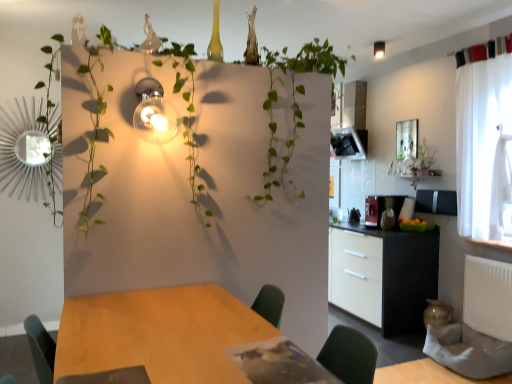
In order to face wooden table at center, should I rotate leftwards or rightwards?

You should rotate left by 11.107 degrees.

Image resolution: width=512 pixels, height=384 pixels. Find the location of `white matte radiator at lower right`. white matte radiator at lower right is located at coordinates tap(488, 297).

This screenshot has width=512, height=384. Describe the element at coordinates (379, 49) in the screenshot. I see `matte glass light fixture at upper right, the first light fixture positioned from the right` at that location.

Locate an element on the screen. The width and height of the screenshot is (512, 384). white sheer curtain at right is located at coordinates (484, 140).

Is the position of black matte cabinet at right less distant than that of green leafy plant at center?

No.

From a real-world perspective, which object stands above the other?

green leafy plant at center is physically above.

Considering the positions of point (389, 325) and point (268, 53), is point (389, 325) closer or farther from the camera than point (268, 53)?

Point (389, 325) appears to be farther away from the viewer than point (268, 53).

Is matte black coffee machine at center right oriented towards white sheer curtain at right?

No.

From the image's perspective, is matte black coffee machine at center right located above or below white sheer curtain at right?

matte black coffee machine at center right is below white sheer curtain at right.

From a real-world perspective, is matte black coffee machine at center right positioned over white sheer curtain at right based on gravity?

No, from a real-world perspective, matte black coffee machine at center right is not over white sheer curtain at right

In the image, is matte black coffee machine at center right on the left side or the right side of white sheer curtain at right?

matte black coffee machine at center right is positioned on white sheer curtain at right's left side.

Which of these two, matte black coffee machine at center right or black matte cabinet at right, is wider?

Wider between the two is black matte cabinet at right.

Between matte black coffee machine at center right and black matte cabinet at right, which one appears on the right side from the viewer's perspective?

From the viewer's perspective, matte black coffee machine at center right appears more on the right side.

Considering the relative sizes of matte black coffee machine at center right and black matte cabinet at right in the image provided, is matte black coffee machine at center right taller than black matte cabinet at right?

No, matte black coffee machine at center right is not taller than black matte cabinet at right.

Is matte black coffee machine at center right surrounded by matte glass light fixture at upper right, which is the 1th light fixture in back-to-front order?

Actually, matte black coffee machine at center right is outside matte glass light fixture at upper right, which is the 1th light fixture in back-to-front order.

Which of these two, matte glass light fixture at upper right, the first light fixture positioned from the right, or matte black coffee machine at center right, is bigger?

matte black coffee machine at center right.

Does matte glass light fixture at upper right, the second light fixture positioned from the bottom, touch matte black coffee machine at center right?

No, matte glass light fixture at upper right, the second light fixture positioned from the bottom, is not touching matte black coffee machine at center right.

From a real-world perspective, is matte glass light fixture at upper right, the second light fixture positioned from the bottom, positioned under matte black coffee machine at center right based on gravity?

No.

Is wooden table at center facing away from matte glass light fixture at upper right, the second light fixture positioned from the bottom?

That's not correct — wooden table at center is not looking away from matte glass light fixture at upper right, the second light fixture positioned from the bottom.

From the image's perspective, is wooden table at center below matte glass light fixture at upper right, the first light fixture positioned from the right?

Correct, wooden table at center appears lower than matte glass light fixture at upper right, the first light fixture positioned from the right, in the image.

Between wooden table at center and matte glass light fixture at upper right, which is the second light fixture from left to right, which one has larger width?

wooden table at center is wider.

Is wooden table at center in front of or behind matte glass light fixture at upper right, the first light fixture positioned from the right, in the image?

Visually, wooden table at center is located in front of matte glass light fixture at upper right, the first light fixture positioned from the right.

Considering the positions of objects white matte radiator at lower right and matte glass light fixture at upper right, arranged as the first light fixture when viewed from the top, in the image provided, who is more to the right, white matte radiator at lower right or matte glass light fixture at upper right, arranged as the first light fixture when viewed from the top,?

white matte radiator at lower right is more to the right.

How many degrees apart are the facing directions of white matte radiator at lower right and matte glass light fixture at upper right, arranged as the first light fixture when viewed from the top?

The angular difference between white matte radiator at lower right and matte glass light fixture at upper right, arranged as the first light fixture when viewed from the top, is 1.52 degrees.

Is white matte radiator at lower right with matte glass light fixture at upper right, which is the second light fixture from left to right?

No, white matte radiator at lower right is not beside matte glass light fixture at upper right, which is the second light fixture from left to right.

Can you confirm if white matte radiator at lower right is wider than matte glass light fixture at upper right, the first light fixture positioned from the right?

In fact, white matte radiator at lower right might be narrower than matte glass light fixture at upper right, the first light fixture positioned from the right.

The image size is (512, 384). In order to click on curtain behind the green leafy plant at center in this screenshot , I will do `click(484, 140)`.

Can you confirm if white sheer curtain at right is positioned to the left of green leafy plant at center?

No, white sheer curtain at right is not to the left of green leafy plant at center.

Is white sheer curtain at right next to green leafy plant at center and touching it?

No, white sheer curtain at right is not with green leafy plant at center.

Does point (509, 93) come behind point (298, 107)?

Yes, point (509, 93) is behind point (298, 107).

Locate an element on the screen. This screenshot has height=384, width=512. cabinetry that is under the green leafy plant at center (from a real-world perspective) is located at coordinates coord(383,275).

The width and height of the screenshot is (512, 384). Find the location of `appliance that appears below the white sheer curtain at right (from the image's perspective)`. appliance that appears below the white sheer curtain at right (from the image's perspective) is located at coordinates (381, 208).

From the image, which object appears to be nearer to matte black coffee machine at center right, matte glass light fixture at upper right, arranged as the first light fixture when viewed from the top, or metallic bulb at upper left, the second light fixture when ordered from top to bottom?

Among the two, matte glass light fixture at upper right, arranged as the first light fixture when viewed from the top, is located nearer to matte black coffee machine at center right.

When comparing their distances from wooden table at center, does white matte radiator at lower right or white sheer curtain at right seem closer?

Based on the image, white matte radiator at lower right appears to be nearer to wooden table at center.

Which object lies further to the anchor point matte glass light fixture at upper right, the second light fixture positioned from the bottom, wooden table at center or metallic bulb at upper left, the second light fixture when ordered from top to bottom?

wooden table at center.

When comparing their distances from wooden table at center, does green leafy plant at center or white matte radiator at lower right seem further?

The object further to wooden table at center is white matte radiator at lower right.

When comparing their distances from white sheer curtain at right, does black matte cabinet at right or green leafy plant at center seem closer?

black matte cabinet at right.

Considering their positions, is wooden table at center positioned further to green leafy plant at center than matte black coffee machine at center right?

matte black coffee machine at center right is positioned further to the anchor green leafy plant at center.

From the image, which object appears to be farther from white matte radiator at lower right, metallic bulb at upper left, the second light fixture when ordered from top to bottom, or white sheer curtain at right?

Among the two, metallic bulb at upper left, the second light fixture when ordered from top to bottom, is located further to white matte radiator at lower right.

Considering their positions, is black matte cabinet at right positioned closer to white matte radiator at lower right than wooden table at center?

Among the two, black matte cabinet at right is located nearer to white matte radiator at lower right.

Where is `curtain situated between wooden table at center and white matte radiator at lower right from left to right`? The height and width of the screenshot is (384, 512). curtain situated between wooden table at center and white matte radiator at lower right from left to right is located at coordinates (484, 140).

Where is `cabinetry between white matte radiator at lower right and matte black coffee machine at center right from front to back`? cabinetry between white matte radiator at lower right and matte black coffee machine at center right from front to back is located at coordinates point(383,275).

Identify the location of vegetation between wooden table at center and black matte cabinet at right along the z-axis. (292, 105).

Where is `radiator between green leafy plant at center and matte black coffee machine at center right from front to back`? radiator between green leafy plant at center and matte black coffee machine at center right from front to back is located at coordinates (488, 297).